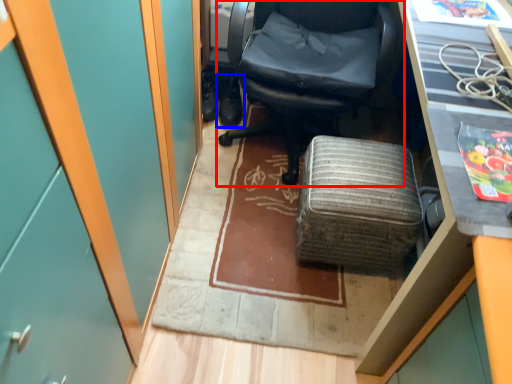
Question: Which object appears farthest to the camera in this image, chair (highlighted by a red box) or footwear (highlighted by a blue box)?

Choices:
 (A) chair
 (B) footwear

Answer: (B)